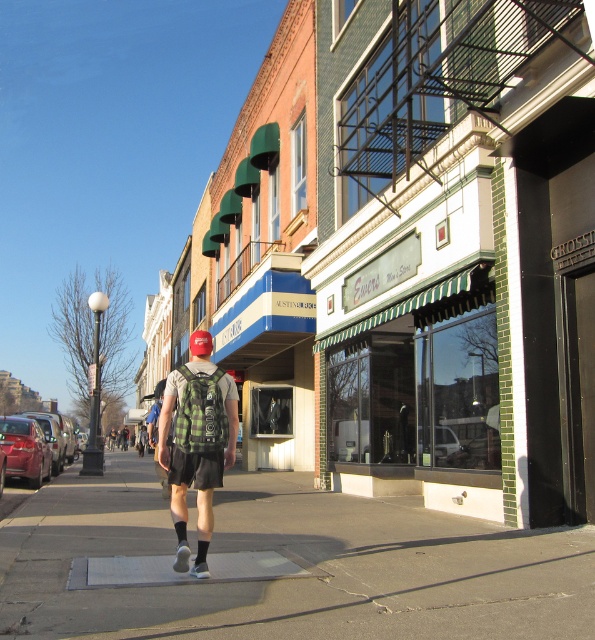
You are a delivery person standing on the gray concrete sidewalk at center and need to place a package on the green plaid backpack at center. Can you do this without stepping off the sidewalk?

The gray concrete sidewalk at center is higher than the green plaid backpack at center, so you can place the package on the green plaid backpack at center without needing to step off the sidewalk.